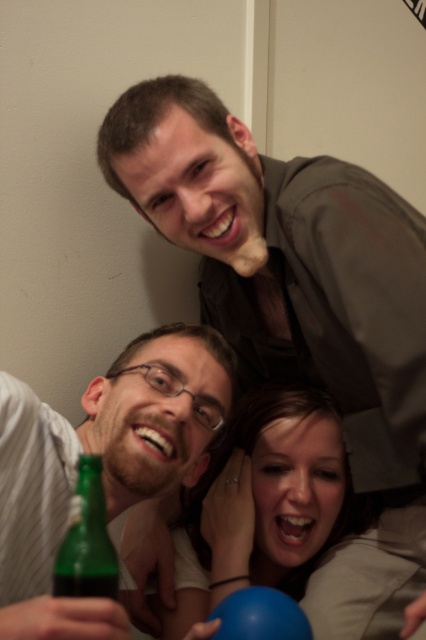
Question: Is green glass bottle at lower left above blue rubber balloon at lower center?

Choices:
 (A) yes
 (B) no

Answer: (A)

Question: Observing the image, what is the correct spatial positioning of green matte bottle at lower left in reference to blue rubber balloon at lower center?

Choices:
 (A) left
 (B) right

Answer: (A)

Question: Which object is positioned farthest from the green matte bottle at lower left?

Choices:
 (A) green glass bottle at lower left
 (B) matte brown shirt at upper center

Answer: (B)

Question: Does matte brown shirt at upper center appear under green matte bottle at lower left?

Choices:
 (A) yes
 (B) no

Answer: (B)

Question: Which of the following is the farthest from the observer?

Choices:
 (A) (8, 611)
 (B) (92, 476)
 (C) (256, 380)

Answer: (C)

Question: Which object appears farthest from the camera in this image?

Choices:
 (A) matte brown shirt at upper center
 (B) green matte bottle at lower left
 (C) blue rubber balloon at lower center
 (D) green glass bottle at lower left

Answer: (A)